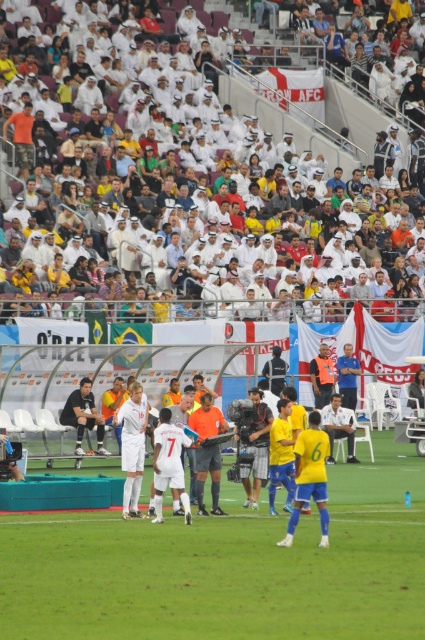
You are a drone operator trying to capture a closeup of the white fabric crowd at upper center. The stadium has a coordinate system where the bottom left corner is 0,0 and the top right corner is 1,1. What are the coordinates you should aim for?

The coordinates for the white fabric crowd at upper center are 0.194 on the x axis and 0.689 on the y axis.

You are a photographer at the football match and you need to adjust your orange fabric camera at center so it points towards the white fabric shirt at center. Which direction should you move the camera?

The orange fabric camera at center is to the left of the white fabric shirt at center. To point the camera towards the shirt, you should move it to the right.

You are a photographer positioned at the edge of the field. You need to capture a photo that includes both the white fabric crowd at upper center and the white matte jersey at center. Which object should appear larger in your photo?

The white fabric crowd at upper center should appear larger in the photo because it is taller than the white matte jersey at center.